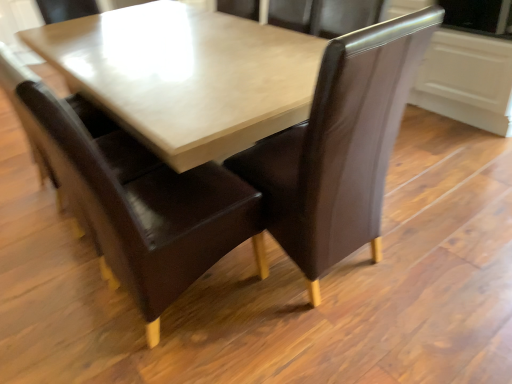
Image resolution: width=512 pixels, height=384 pixels. Identify the location of vacant area to the right of brown leather chair at center, the 2th chair in the right-to-left sequence. click(292, 329).